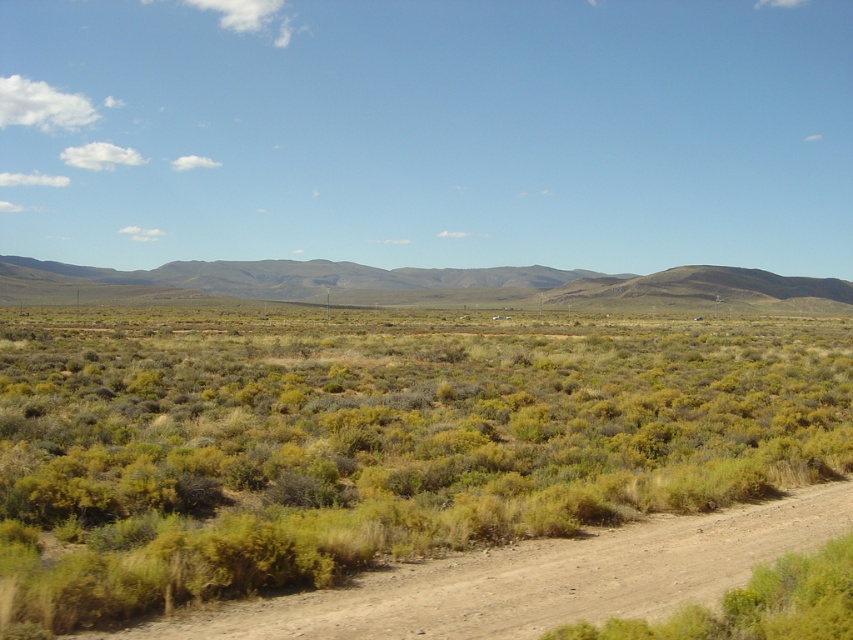
Between brown dirt track at lower center and brown/dry grassy at center, which one has more height?

brown/dry grassy at center is taller.

Can you confirm if brown dirt track at lower center is bigger than brown/dry grassy at center?

Incorrect, brown dirt track at lower center is not larger than brown/dry grassy at center.

The width and height of the screenshot is (853, 640). In order to click on brown dirt track at lower center in this screenshot , I will do (534, 579).

Between point (450, 467) and point (459, 273), which one is positioned in front?

Point (450, 467) is more forward.

Is green shrubbery at center below brown/dry grassy at center?

Yes, green shrubbery at center is below brown/dry grassy at center.

Which is behind, point (426, 445) or point (347, 275)?

Positioned behind is point (347, 275).

The image size is (853, 640). In order to click on green shrubbery at center in this screenshot , I will do `click(372, 444)`.

Does green shrubbery at center have a larger size compared to brown dirt track at lower center?

Yes, green shrubbery at center is bigger than brown dirt track at lower center.

Does green shrubbery at center lie in front of brown dirt track at lower center?

No, green shrubbery at center is further to the viewer.

Describe the element at coordinates (372, 444) in the screenshot. The height and width of the screenshot is (640, 853). I see `green shrubbery at center` at that location.

I want to click on green shrubbery at center, so click(372, 444).